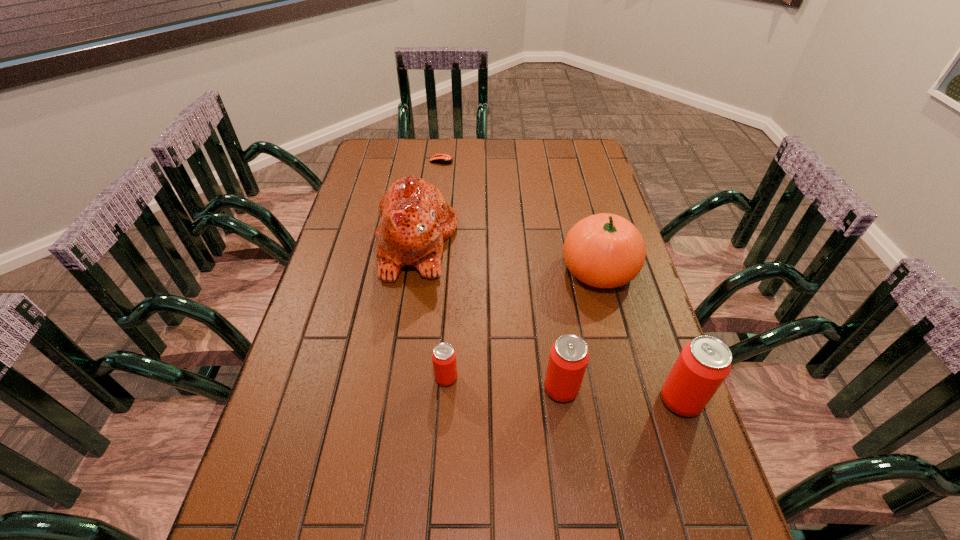
Find the location of a particular element. The image size is (960, 540). blank region between the second tallest beer can and the leftmost beer can is located at coordinates (504, 383).

Locate an element on the screen. Image resolution: width=960 pixels, height=540 pixels. free area in between the shortest object and the rightmost beer can is located at coordinates (561, 280).

Identify the location of object that is the third nearest to the pumpkin. Image resolution: width=960 pixels, height=540 pixels. (415, 219).

At what (x,y) coordinates should I click in order to perform the action: click on the fifth closest object relative to the shortest object. Please return your answer as a coordinate pair (x, y). This screenshot has height=540, width=960. Looking at the image, I should click on (704, 363).

Identify which beer can is the closest to the farthest object. Please provide its 2D coordinates. Your answer should be formatted as a tuple, i.e. [(x, y)], where the tuple contains the x and y coordinates of a point satisfying the conditions above.

[(444, 356)]

Locate which beer can ranks second in proximity to the cat. Please provide its 2D coordinates. Your answer should be formatted as a tuple, i.e. [(x, y)], where the tuple contains the x and y coordinates of a point satisfying the conditions above.

[(568, 359)]

This screenshot has width=960, height=540. I want to click on vacant region that satisfies the following two spatial constraints: 1. on the front side of the rightmost beer can; 2. on the left side of the second shortest beer can, so click(x=563, y=400).

The width and height of the screenshot is (960, 540). Find the location of `vacant region that satisfies the following two spatial constraints: 1. on the face of the cat; 2. on the right side of the rightmost beer can`. vacant region that satisfies the following two spatial constraints: 1. on the face of the cat; 2. on the right side of the rightmost beer can is located at coordinates (393, 400).

The height and width of the screenshot is (540, 960). In order to click on free spot that satisfies the following two spatial constraints: 1. on the front side of the rightmost beer can; 2. on the right side of the shortest object in this screenshot , I will do pyautogui.click(x=415, y=400).

You are a GUI agent. You are given a task and a screenshot of the screen. Output one action in this format:
    pyautogui.click(x=<x>, y=<y>)
    Task: Click on the vacant region that satisfies the following two spatial constraints: 1. on the front side of the leftmost beer can; 2. on the right side of the second beer can from right to left
    Image resolution: width=960 pixels, height=540 pixels.
    Given the screenshot: What is the action you would take?
    pyautogui.click(x=445, y=389)